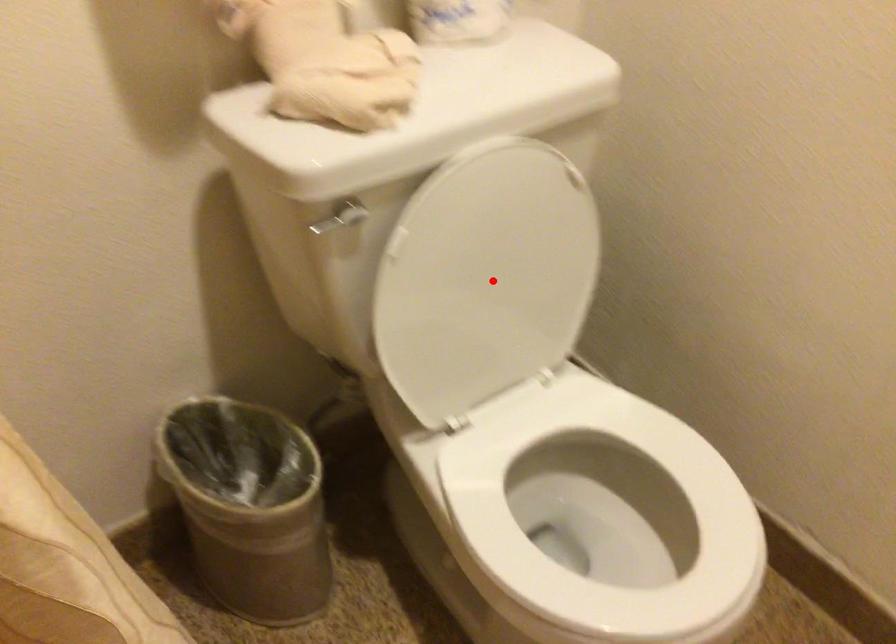
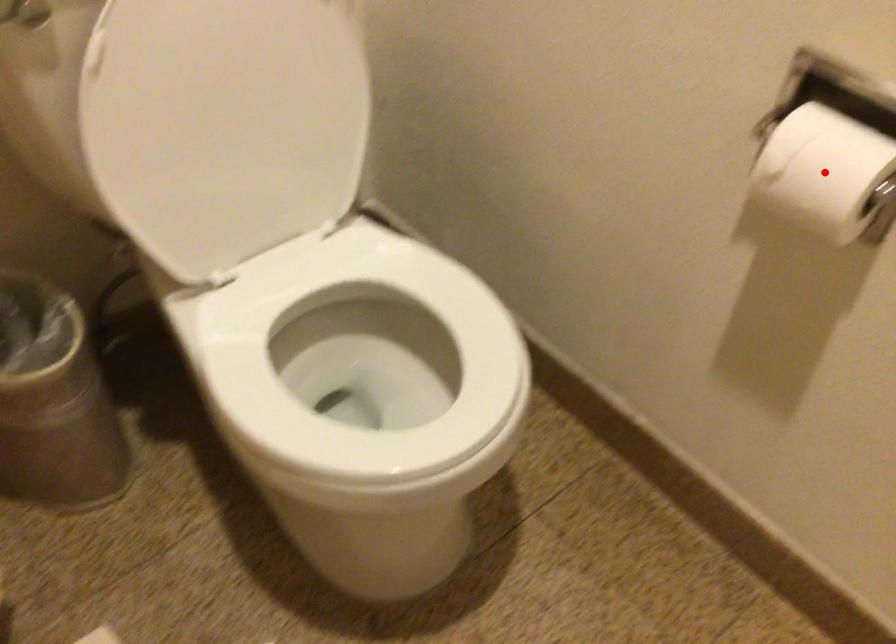
I am providing you with two images of the same scene from different viewpoints. A red point is marked on the first image and another point is marked on the second image. Is the red point in image1 aligned with the point shown in image2?

No